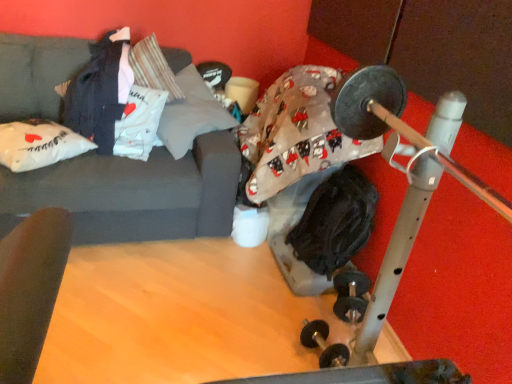
Question: From the image's perspective, relative to gray fabric pillow at upper center, positioned as the second pillow in left-to-right order, is black fabric at center, the 2th clothing in the top-to-bottom sequence, above or below?

Choices:
 (A) above
 (B) below

Answer: (B)

Question: Is black fabric at center, the 2th clothing in the top-to-bottom sequence, wider or thinner than gray fabric pillow at upper center, positioned as the second pillow in left-to-right order?

Choices:
 (A) wide
 (B) thin

Answer: (B)

Question: Estimate the real-world distances between objects in this image. Which object is farther from the black rubber dumbbells at lower center?

Choices:
 (A) black fabric at center, acting as the first clothing starting from the bottom
 (B) gray fabric pillow at upper center, positioned as the second pillow in left-to-right order
 (C) white fabric pillow at left, arranged as the 2th pillow when viewed from the right
 (D) dark gray fabric at upper left, the first clothing positioned from the top
 (E) dark gray fabric couch at upper left

Answer: (C)

Question: Considering the real-world distances, which object is farthest from the black rubber dumbbells at lower center?

Choices:
 (A) black fabric at center, which is the second clothing from left to right
 (B) gray fabric pillow at upper center, positioned as the second pillow in left-to-right order
 (C) white fabric pillow at left, marked as the first pillow in a left-to-right arrangement
 (D) dark gray fabric at upper left, the 2th clothing viewed from the right
 (E) dark gray fabric couch at upper left

Answer: (C)